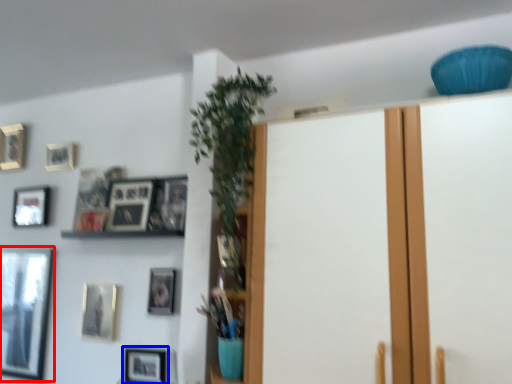
Question: Which point is further to the camera, picture frame (highlighted by a red box) or picture frame (highlighted by a blue box)?

Choices:
 (A) picture frame
 (B) picture frame

Answer: (A)